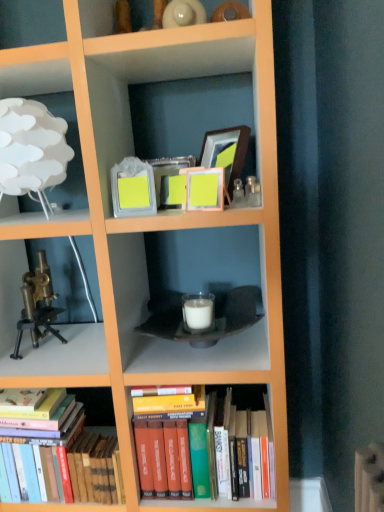
Question: From the image's perspective, is hardcover books at lower left, which appears as the second book when viewed from the right, on top of matte glass picture frame at upper center, arranged as the 2th picture frame when viewed from the front?

Choices:
 (A) yes
 (B) no

Answer: (B)

Question: Is hardcover books at lower left, which appears as the second book when viewed from the right, wider than matte glass picture frame at upper center, the third picture frame when ordered from right to left?

Choices:
 (A) no
 (B) yes

Answer: (B)

Question: Does hardcover books at lower left, acting as the first book starting from the left, have a lesser width compared to matte glass picture frame at upper center, which is the second picture frame from back to front?

Choices:
 (A) no
 (B) yes

Answer: (A)

Question: Can you confirm if hardcover books at lower left, acting as the first book starting from the left, is positioned to the right of matte glass picture frame at upper center, which is the second picture frame from back to front?

Choices:
 (A) yes
 (B) no

Answer: (B)

Question: Does hardcover books at lower left, acting as the first book starting from the left, lie behind matte glass picture frame at upper center, which is the second picture frame from back to front?

Choices:
 (A) no
 (B) yes

Answer: (B)

Question: Is hardcover books at lower left, acting as the first book starting from the left, inside the boundaries of brass metallic microscope at left, or outside?

Choices:
 (A) inside
 (B) outside

Answer: (B)

Question: Is hardcover books at lower left, acting as the first book starting from the left, in front of or behind brass metallic microscope at left in the image?

Choices:
 (A) front
 (B) behind

Answer: (A)

Question: Looking at their shapes, would you say hardcover books at lower left, acting as the first book starting from the left, is wider or thinner than brass metallic microscope at left?

Choices:
 (A) wide
 (B) thin

Answer: (B)

Question: Is point (59, 495) closer or farther from the camera than point (29, 323)?

Choices:
 (A) closer
 (B) farther

Answer: (A)

Question: Do you think matte yellow picture frame at center, arranged as the third picture frame when viewed from the back, is within matte glass picture frame at upper center, the third picture frame when ordered from right to left, or outside of it?

Choices:
 (A) inside
 (B) outside

Answer: (B)

Question: In terms of size, does matte yellow picture frame at center, the second picture frame from the left, appear bigger or smaller than matte glass picture frame at upper center, which ranks as the first picture frame in left-to-right order?

Choices:
 (A) small
 (B) big

Answer: (A)

Question: Based on their positions, is matte yellow picture frame at center, the second picture frame from the left, located to the left or right of matte glass picture frame at upper center, the third picture frame when ordered from right to left?

Choices:
 (A) left
 (B) right

Answer: (B)

Question: Is matte yellow picture frame at center, the second picture frame from the left, wider or thinner than matte glass picture frame at upper center, the third picture frame when ordered from right to left?

Choices:
 (A) thin
 (B) wide

Answer: (A)

Question: In terms of width, does wooden picture frame at upper center, which appears as the 1th picture frame when viewed from the back, look wider or thinner when compared to matte yellow picture frame at center, the second picture frame from the left?

Choices:
 (A) wide
 (B) thin

Answer: (A)

Question: Based on their sizes in the image, would you say wooden picture frame at upper center, which appears as the third picture frame when viewed from the front, is bigger or smaller than matte yellow picture frame at center, the 2th picture frame from the right?

Choices:
 (A) big
 (B) small

Answer: (A)